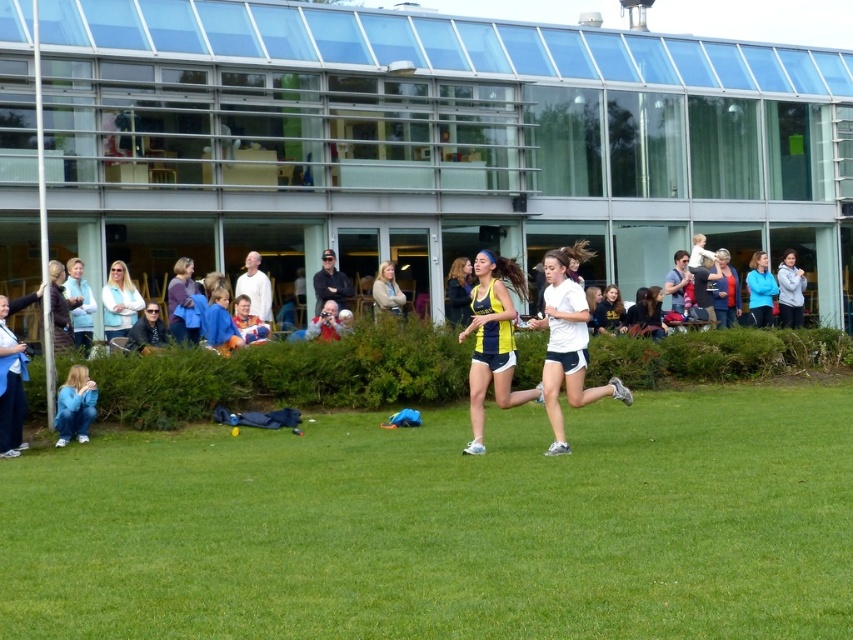
You are a photographer standing at the edge of the field. You want to capture a photo that includes both the green grass at center and the yellow and blue athletic uniform at center. Based on their widths, which object should you focus on to ensure both fit in the frame?

The green grass at center might be wider than yellow and blue athletic uniform at center, so focusing on the wider green grass at center would ensure both fit in the frame.

You are a photographer standing at the edge of the grassy field. You want to capture a photo of the white matte running shoes at center and the light brown leather jacket at center. Which object should you focus on first if you want to ensure both are in sharp focus?

The white matte running shoes at center is below the light brown leather jacket at center, so you should focus on the light brown leather jacket at center first to ensure both are in sharp focus.

You are a photographer trying to capture a photo of both the white matte running shoes at center and the light brown leather jacket at center in the same frame. Based on their positions, which object should you adjust your camera to focus on first to ensure both are in the shot?

The light brown leather jacket at center is to the left of the white matte running shoes at center, so you should focus on the light brown leather jacket at center first to ensure both are in the frame.